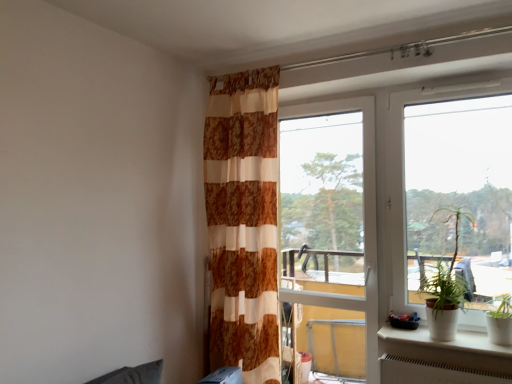
Where is `free space above transparent glass screen door at center (from a real-world perspective)`? The height and width of the screenshot is (384, 512). free space above transparent glass screen door at center (from a real-world perspective) is located at coordinates (336, 96).